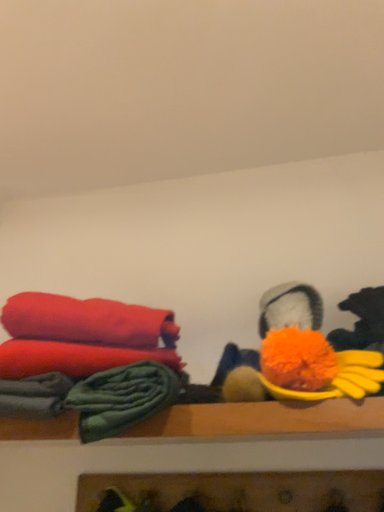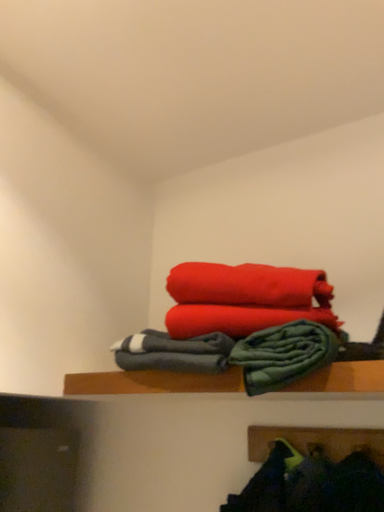
Question: How did the camera likely rotate when shooting the video?

Choices:
 (A) rotated right
 (B) rotated left

Answer: (B)